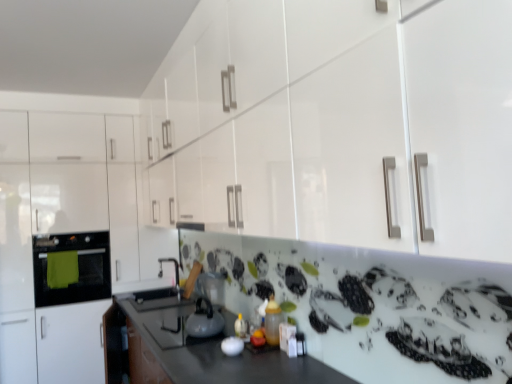
Identify the location of satin silver kettle at center, acting as the first appliance starting from the left. This screenshot has width=512, height=384. [210, 287].

Looking at this image, measure the distance between point [231,343] and camera.

Point [231,343] and camera are 2.11 meters apart from each other.

This screenshot has height=384, width=512. What do you see at coordinates (77, 269) in the screenshot? I see `matte black oven at left` at bounding box center [77, 269].

Locate an element on the screen. white glossy kettle at center is located at coordinates (204, 320).

Is white glossy kettle at center, the 2th appliance from the left, aimed at matte black oven at left?

No, white glossy kettle at center, the 2th appliance from the left, is not oriented towards matte black oven at left.

Does point (229, 348) lie in front of point (106, 262)?

Yes, point (229, 348) is closer to viewer.

Considering the relative sizes of white glossy kettle at center, positioned as the first appliance in front-to-back order, and matte black oven at left in the image provided, is white glossy kettle at center, positioned as the first appliance in front-to-back order, taller than matte black oven at left?

Incorrect, the height of white glossy kettle at center, positioned as the first appliance in front-to-back order, is not larger of that of matte black oven at left.

From the picture: Is white glossy kettle at center, placed as the second appliance when sorted from back to front, directly adjacent to matte black oven at left?

white glossy kettle at center, placed as the second appliance when sorted from back to front, and matte black oven at left are clearly separated.

Can you confirm if white glossy cabinet at left is thinner than matte black oven at left?

Incorrect, the width of white glossy cabinet at left is not less than that of matte black oven at left.

Considering the relative positions of white glossy cabinet at left and matte black oven at left in the image provided, is white glossy cabinet at left in front of matte black oven at left?

Yes, it is.

Is white glossy cabinet at left at the left side of matte black oven at left?

In fact, white glossy cabinet at left is to the right of matte black oven at left.

What's the angular difference between white glossy cabinet at left and matte black oven at left's facing directions?

0.000301 degrees separate the facing orientations of white glossy cabinet at left and matte black oven at left.

Could white glossy cabinet at left be considered to be inside matte black oven at left?

No, white glossy cabinet at left is not inside matte black oven at left.

Where is `home appliance below the white glossy cabinet at left (from the image's perspective)`? The image size is (512, 384). home appliance below the white glossy cabinet at left (from the image's perspective) is located at coordinates (77, 269).

How many degrees apart are the facing directions of matte black oven at left and white glossy cabinet at left?

matte black oven at left and white glossy cabinet at left are facing 0.000301 degrees away from each other.

Who is smaller, matte black oven at left or satin silver kettle at center, acting as the first appliance starting from the left?

Smaller between the two is satin silver kettle at center, acting as the first appliance starting from the left.

From a real-world perspective, is matte black oven at left beneath satin silver kettle at center, which appears as the second appliance when viewed from the front?

No, from a real-world perspective, matte black oven at left is not under satin silver kettle at center, which appears as the second appliance when viewed from the front.

Are matte black oven at left and satin silver kettle at center, which is the second appliance in right-to-left order, located far from each other?

Yes, matte black oven at left is far from satin silver kettle at center, which is the second appliance in right-to-left order.

From the image's perspective, is matte black oven at left below satin silver kettle at center, placed as the 1th appliance when sorted from back to front?

Actually, matte black oven at left appears above satin silver kettle at center, placed as the 1th appliance when sorted from back to front, in the image.

From a real-world perspective, is matte black oven at left located beneath white glossy kettle at center, positioned as the 1th appliance in right-to-left order?

Actually, matte black oven at left is physically above white glossy kettle at center, positioned as the 1th appliance in right-to-left order, in the real world.

Is matte black oven at left wider than white glossy kettle at center, positioned as the 1th appliance in right-to-left order?

Indeed, matte black oven at left has a greater width compared to white glossy kettle at center, positioned as the 1th appliance in right-to-left order.

Are matte black oven at left and white glossy kettle at center, placed as the second appliance when sorted from back to front, making contact?

matte black oven at left and white glossy kettle at center, placed as the second appliance when sorted from back to front, are not in contact.

Looking at the image, does white glossy cabinet at left seem bigger or smaller compared to white glossy kettle at center, positioned as the first appliance in front-to-back order?

In the image, white glossy cabinet at left appears to be larger than white glossy kettle at center, positioned as the first appliance in front-to-back order.

Which of these two, white glossy cabinet at left or white glossy kettle at center, placed as the second appliance when sorted from back to front, stands taller?

white glossy cabinet at left is taller.

The image size is (512, 384). Find the location of `cabinetry lying behind the white glossy kettle at center, positioned as the first appliance in front-to-back order`. cabinetry lying behind the white glossy kettle at center, positioned as the first appliance in front-to-back order is located at coordinates (63, 238).

Is the surface of white glossy cabinet at left in direct contact with white glossy kettle at center, positioned as the first appliance in front-to-back order?

white glossy cabinet at left and white glossy kettle at center, positioned as the first appliance in front-to-back order, are clearly separated.

Between satin silver kettle at center, which appears as the second appliance when viewed from the front, and white glossy kettle at center, which one has smaller size?

white glossy kettle at center.

Find the location of a particular element. appliance that is above the white glossy kettle at center (from the image's perspective) is located at coordinates (210, 287).

Is satin silver kettle at center, placed as the 1th appliance when sorted from back to front, positioned in front of white glossy kettle at center?

No, satin silver kettle at center, placed as the 1th appliance when sorted from back to front, is further to the viewer.

Between point (222, 295) and point (215, 322), which one is positioned in front?

Positioned in front is point (215, 322).

Locate an element on the screen. the 2nd appliance below when counting from the matte black oven at left (from the image's perspective) is located at coordinates (232, 346).

You are a GUI agent. You are given a task and a screenshot of the screen. Output one action in this format:
    pyautogui.click(x=<x>, y=<y>)
    Task: Click on the home appliance behind the white glossy cabinet at left
    The height and width of the screenshot is (384, 512).
    Given the screenshot: What is the action you would take?
    pyautogui.click(x=77, y=269)

When comparing their distances from matte black oven at left, does satin silver kettle at center, placed as the 1th appliance when sorted from back to front, or white glossy kettle at center, the 2th appliance from the left, seem closer?

satin silver kettle at center, placed as the 1th appliance when sorted from back to front, is positioned closer to the anchor matte black oven at left.

Based on their spatial positions, is satin silver kettle at center, acting as the first appliance starting from the left, or white glossy kettle at center closer to white glossy cabinet at left?

Based on the image, satin silver kettle at center, acting as the first appliance starting from the left, appears to be nearer to white glossy cabinet at left.

Looking at the image, which one is located further to matte black oven at left, white glossy cabinet at left or satin silver kettle at center, placed as the 1th appliance when sorted from back to front?

satin silver kettle at center, placed as the 1th appliance when sorted from back to front, is positioned further to the anchor matte black oven at left.

Estimate the real-world distances between objects in this image. Which object is closer to satin silver kettle at center, placed as the 1th appliance when sorted from back to front, white glossy kettle at center, the 2th appliance from the left, or white glossy cabinet at left?

white glossy kettle at center, the 2th appliance from the left, is closer to satin silver kettle at center, placed as the 1th appliance when sorted from back to front.

When comparing their distances from white glossy kettle at center, does satin silver kettle at center, which appears as the second appliance when viewed from the front, or matte black oven at left seem further?

Among the two, matte black oven at left is located further to white glossy kettle at center.

Looking at the image, which one is located further to matte black oven at left, white glossy cabinet at left or white glossy kettle at center?

white glossy kettle at center is positioned further to the anchor matte black oven at left.

Which object lies further to the anchor point satin silver kettle at center, placed as the 1th appliance when sorted from back to front, white glossy kettle at center, positioned as the 1th appliance in right-to-left order, or white glossy kettle at center?

Among the two, white glossy kettle at center, positioned as the 1th appliance in right-to-left order, is located further to satin silver kettle at center, placed as the 1th appliance when sorted from back to front.

Which object lies further to the anchor point white glossy kettle at center, white glossy kettle at center, positioned as the 1th appliance in right-to-left order, or matte black oven at left?

Among the two, matte black oven at left is located further to white glossy kettle at center.

This screenshot has width=512, height=384. What are the coordinates of `appliance between white glossy cabinet at left and white glossy kettle at center from left to right` in the screenshot? It's located at (210, 287).

You are a GUI agent. You are given a task and a screenshot of the screen. Output one action in this format:
    pyautogui.click(x=<x>, y=<y>)
    Task: Click on the cabinetry between matte black oven at left and satin silver kettle at center, acting as the first appliance starting from the left, from left to right
    Image resolution: width=512 pixels, height=384 pixels.
    Given the screenshot: What is the action you would take?
    pyautogui.click(x=63, y=238)

Find the location of a particular element. kitchen appliance between white glossy kettle at center, the 2th appliance from the left, and satin silver kettle at center, placed as the 1th appliance when sorted from back to front, in the front-back direction is located at coordinates (204, 320).

Locate an element on the screen. appliance located between white glossy cabinet at left and white glossy kettle at center, positioned as the first appliance in front-to-back order, in the left-right direction is located at coordinates (210, 287).